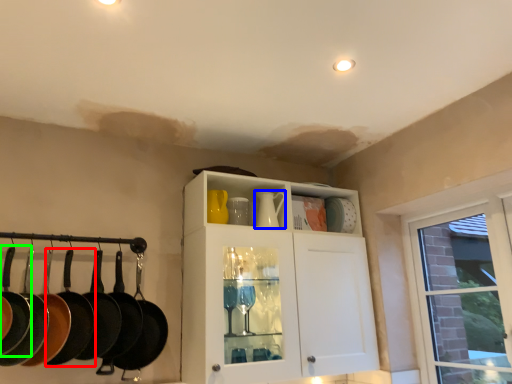
Question: Which object is the closest to the frying pan (highlighted by a red box)? Choose among these: tea pot (highlighted by a blue box) or frying pan (highlighted by a green box).

Choices:
 (A) tea pot
 (B) frying pan

Answer: (B)